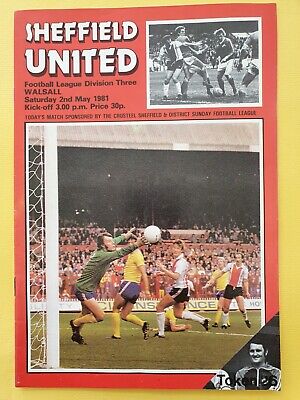
Locate an element on the screen. Image resolution: width=300 pixels, height=400 pixels. black and white pictures is located at coordinates (190, 89), (271, 355).